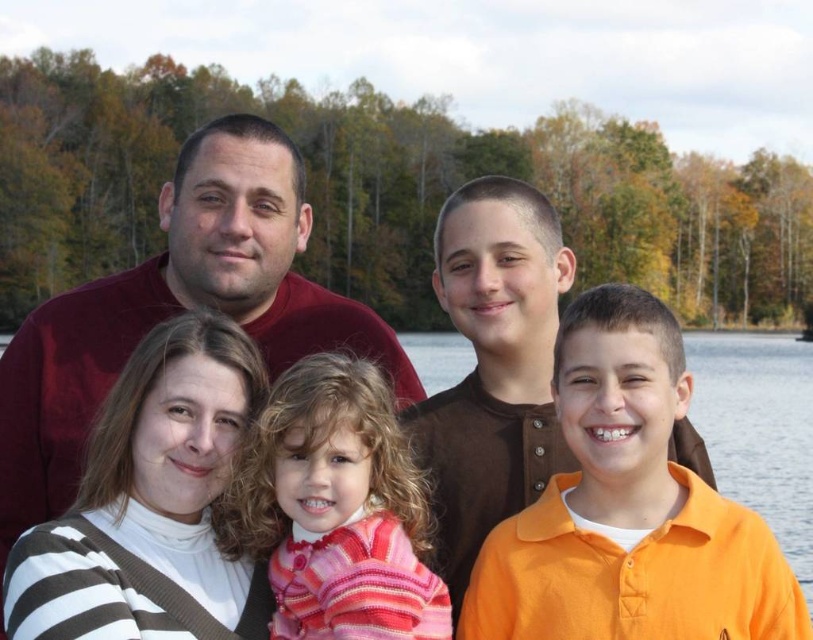
Question: Which object is closer to the camera taking this photo?

Choices:
 (A) striped knit sweater at center
 (B) white striped sweater at lower left
 (C) orange cotton shirt at lower right

Answer: (A)

Question: Can you confirm if brown cotton shirt at center is positioned below orange shirt at center?

Choices:
 (A) yes
 (B) no

Answer: (B)

Question: Can you confirm if orange cotton shirt at lower right is positioned to the right of brown cotton shirt at center?

Choices:
 (A) no
 (B) yes

Answer: (B)

Question: Among these points, which one is nearest to the camera?

Choices:
 (A) tap(398, 388)
 (B) tap(709, 451)
 (C) tap(525, 352)

Answer: (C)

Question: Estimate the real-world distances between objects in this image. Which object is farther from the orange shirt at center?

Choices:
 (A) orange cotton shirt at lower right
 (B) striped knit sweater at center
 (C) white striped sweater at lower left

Answer: (A)

Question: Does velvet maroon sweater at upper left have a larger size compared to white striped sweater at lower left?

Choices:
 (A) yes
 (B) no

Answer: (A)